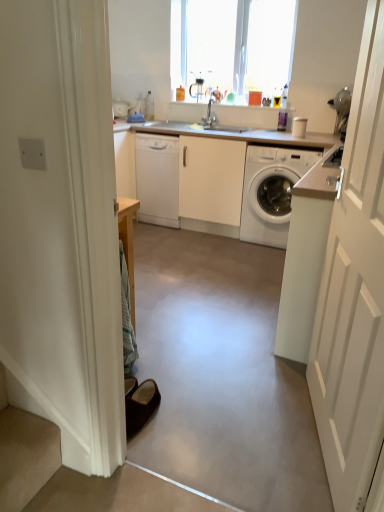
Locate an element on the screen. free space underneath brown suede slippers at lower left (from a real-world perspective) is located at coordinates (153, 415).